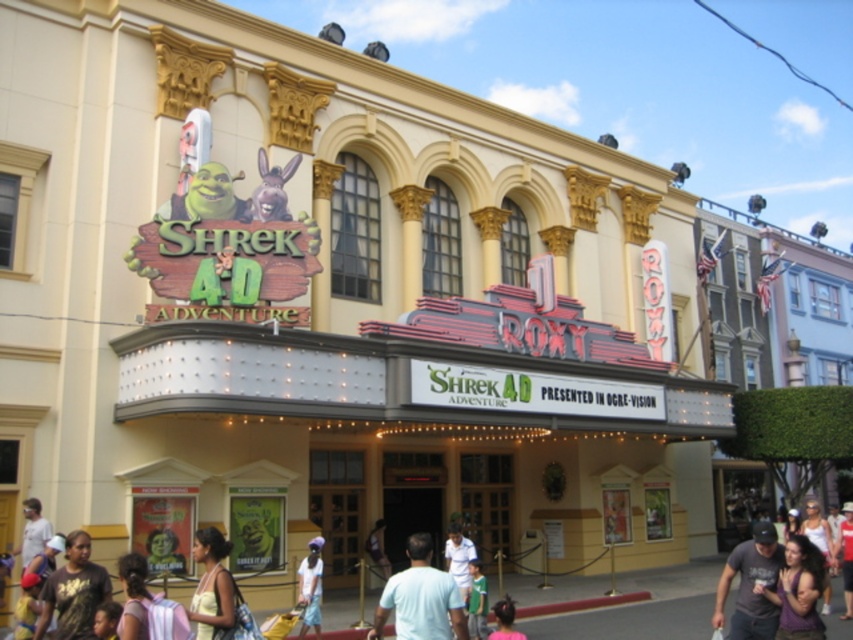
Between light blue cotton shirt at center and purple fabric shirt at lower right, which one is positioned lower?

light blue cotton shirt at center

Between light blue cotton shirt at center and purple fabric shirt at lower right, which one has less height?

With less height is purple fabric shirt at lower right.

Where is `light blue cotton shirt at center`? light blue cotton shirt at center is located at coordinates (421, 598).

Identify the location of light blue cotton shirt at center. tap(421, 598).

Between dark gray cotton t-shirt at center and light blue shirt at lower left, which one is positioned higher?

Positioned higher is light blue shirt at lower left.

Is dark gray cotton t-shirt at center bigger than light blue shirt at lower left?

Correct, dark gray cotton t-shirt at center is larger in size than light blue shirt at lower left.

Who is more forward, [732,573] or [38,550]?

Point [732,573]

Find the location of a particular element. This screenshot has width=853, height=640. dark gray cotton t-shirt at center is located at coordinates (751, 586).

Is light blue cotton shirt at center positioned behind dark gray cotton t-shirt at center?

No, it is not.

Which is more to the right, light blue cotton shirt at center or dark gray cotton t-shirt at center?

dark gray cotton t-shirt at center is more to the right.

Describe the element at coordinates (421, 598) in the screenshot. I see `light blue cotton shirt at center` at that location.

The height and width of the screenshot is (640, 853). Identify the location of light blue cotton shirt at center. (421, 598).